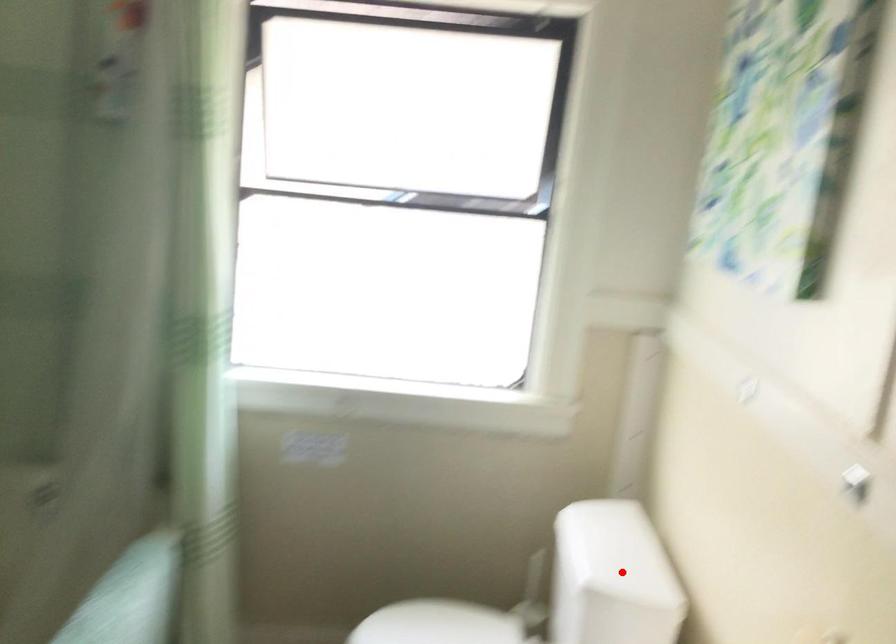
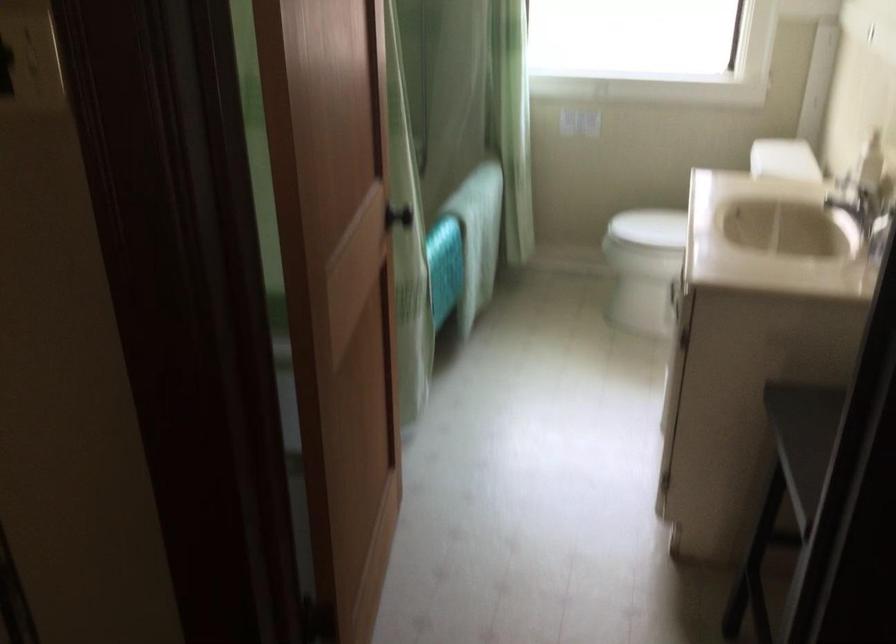
The point at the highlighted location is marked in the first image. Where is the corresponding point in the second image?

(784, 158)